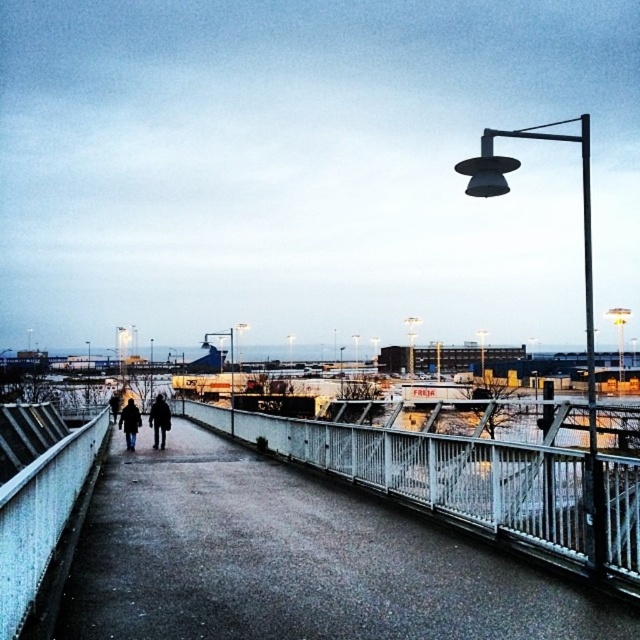
Question: Is dark gray jacket at center positioned at the back of dark blue coat at center?

Choices:
 (A) yes
 (B) no

Answer: (A)

Question: Is dark gray jacket at center closer to the viewer compared to dark blue coat at center?

Choices:
 (A) no
 (B) yes

Answer: (A)

Question: Among these points, which one is nearest to the camera?

Choices:
 (A) (131, 451)
 (B) (74, 536)

Answer: (B)

Question: Which of the following is the farthest from the observer?

Choices:
 (A) dark gray wool coat at center
 (B) dark blue coat at center
 (C) dark gray jacket at center
 (D) concrete pavement at center

Answer: (C)

Question: Which of these objects is positioned closest to the dark blue coat at center?

Choices:
 (A) concrete pavement at center
 (B) dark gray wool coat at center

Answer: (B)

Question: Can you confirm if dark gray jacket at center is positioned to the right of dark blue coat at center?

Choices:
 (A) yes
 (B) no

Answer: (A)